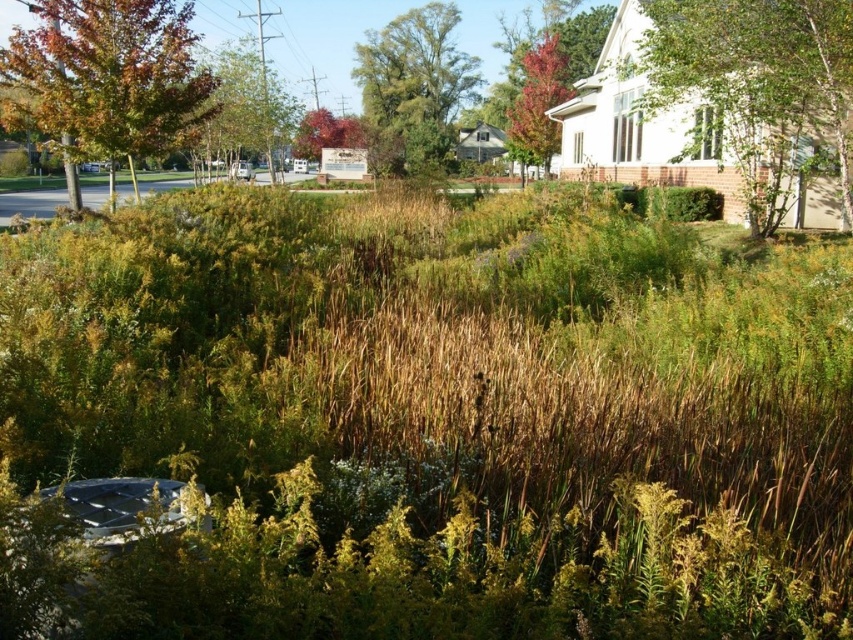
Does green grass at center appear over green leafy tree at upper left?

Incorrect, green grass at center is not positioned above green leafy tree at upper left.

From the picture: Does green grass at center appear on the left side of green leafy tree at upper left?

In fact, green grass at center is to the right of green leafy tree at upper left.

Which is behind, point (97, 237) or point (242, 138)?

The point (242, 138) is more distant.

This screenshot has height=640, width=853. Find the location of `green grass at center`. green grass at center is located at coordinates (428, 420).

From the picture: Between green grass at center and reddish-brown bark tree at upper right, which one is positioned lower?

green grass at center is lower down.

Does point (65, 241) lie behind point (550, 35)?

No, (65, 241) is closer to viewer.

Identify the location of green grass at center. (428, 420).

Who is positioned more to the right, autumn leaves at upper left or reddish-brown bark tree at upper right?

From the viewer's perspective, reddish-brown bark tree at upper right appears more on the right side.

Does autumn leaves at upper left have a greater width compared to reddish-brown bark tree at upper right?

Correct, the width of autumn leaves at upper left exceeds that of reddish-brown bark tree at upper right.

Who is more distant from viewer, (107, 100) or (523, 129)?

Positioned behind is point (523, 129).

Where is `autumn leaves at upper left`? The image size is (853, 640). autumn leaves at upper left is located at coordinates (109, 76).